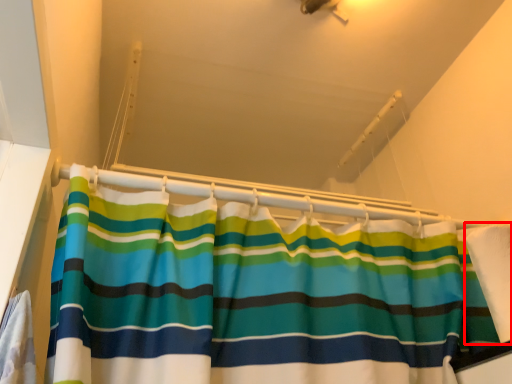
Question: From the image's perspective, what is the correct spatial positioning of fabric (annotated by the red box) in reference to balustrade?

Choices:
 (A) below
 (B) above

Answer: (A)